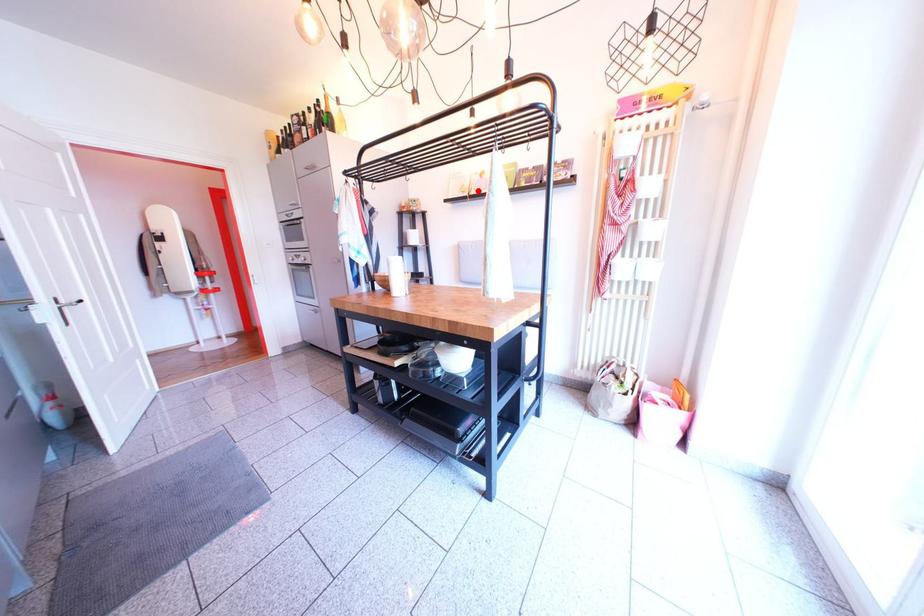
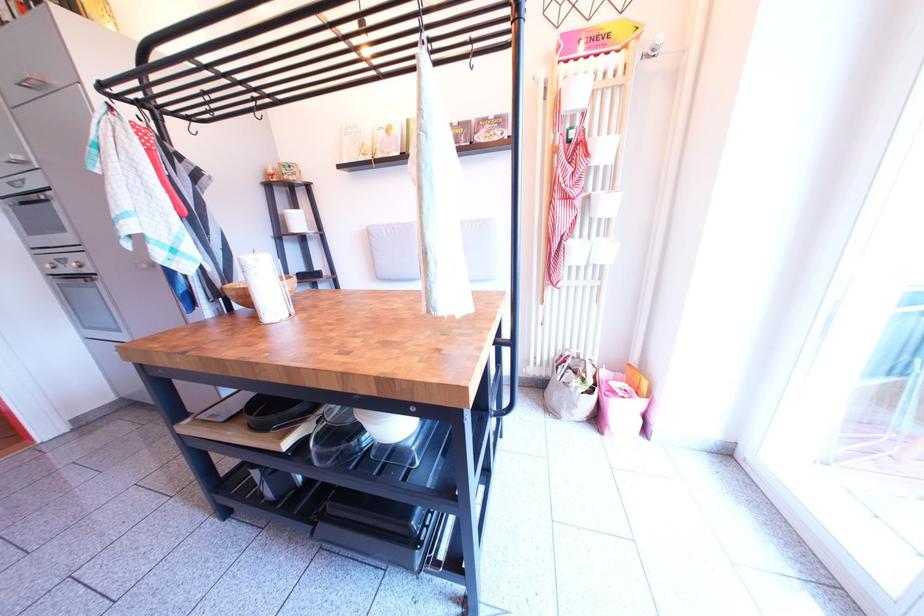
Locate, in the second image, the point that corresponds to the highlighted location in the first image.

(380, 150)